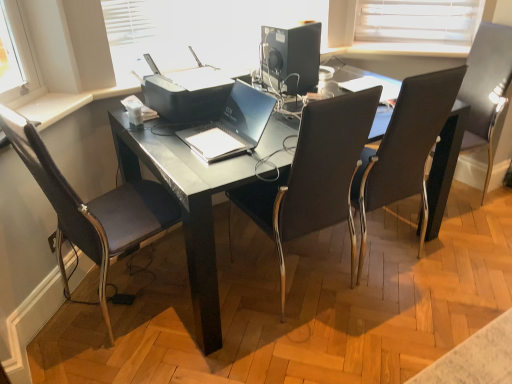
What is the approximate height of black leather chair at upper right, which is counted as the 1th chair, starting from the right?

black leather chair at upper right, which is counted as the 1th chair, starting from the right, is 3.30 feet tall.

Measure the distance between black leather chair at center, arranged as the 2th chair when viewed from the left, and camera.

black leather chair at center, arranged as the 2th chair when viewed from the left, and camera are 1.36 meters apart from each other.

At what (x,y) coordinates should I click in order to perform the action: click on black leather chair at center, which is the third chair in right-to-left order. Please return your answer as a coordinate pair (x, y). Looking at the image, I should click on (313, 176).

In order to face black leather chair at center, which appears as the second chair when viewed from the right, should I rotate leftwards or rightwards?

To face it directly, rotate right by 15.868 degrees.

Identify the location of black plastic desktop computer at upper center. The image size is (512, 384). (291, 57).

Is black leather chair at center, which appears as the second chair when viewed from the right, outside of black leather chair at upper right, which is counted as the 1th chair, starting from the right?

Indeed, black leather chair at center, which appears as the second chair when viewed from the right, is completely outside black leather chair at upper right, which is counted as the 1th chair, starting from the right.

Considering the relative sizes of black leather chair at center, placed as the third chair when sorted from left to right, and black leather chair at upper right, which is counted as the 1th chair, starting from the right, in the image provided, is black leather chair at center, placed as the third chair when sorted from left to right, wider than black leather chair at upper right, which is counted as the 1th chair, starting from the right,?

Correct, the width of black leather chair at center, placed as the third chair when sorted from left to right, exceeds that of black leather chair at upper right, which is counted as the 1th chair, starting from the right.

Could you tell me if black leather chair at center, placed as the third chair when sorted from left to right, is facing black leather chair at upper right, which is counted as the 1th chair, starting from the right?

No, black leather chair at center, placed as the third chair when sorted from left to right, does not turn towards black leather chair at upper right, which is counted as the 1th chair, starting from the right.

Who is taller, black leather chair at center, which appears as the second chair when viewed from the right, or black leather chair at upper right, acting as the 4th chair starting from the left?

Standing taller between the two is black leather chair at upper right, acting as the 4th chair starting from the left.

Is black leather chair at center, which appears as the second chair when viewed from the right, positioned with its back to black plastic printer at center?

black leather chair at center, which appears as the second chair when viewed from the right, does not have its back to black plastic printer at center.

Where is `the 1st chair in front of the black plastic printer at center`? the 1st chair in front of the black plastic printer at center is located at coordinates (405, 149).

Is black leather chair at center, which appears as the second chair when viewed from the right, far from black plastic printer at center?

No, black leather chair at center, which appears as the second chair when viewed from the right, is in close proximity to black plastic printer at center.

Can you tell me how much black leather chair at center, placed as the third chair when sorted from left to right, and black plastic printer at center differ in facing direction?

177 degrees separate the facing orientations of black leather chair at center, placed as the third chair when sorted from left to right, and black plastic printer at center.

Considering the positions of point (151, 63) and point (409, 180), is point (151, 63) closer or farther from the camera than point (409, 180)?

Point (151, 63).

Can you see black plastic printer at center touching black leather chair at center, placed as the third chair when sorted from left to right?

No, black plastic printer at center is not beside black leather chair at center, placed as the third chair when sorted from left to right.

Is black plastic printer at center taller or shorter than black leather chair at center, placed as the third chair when sorted from left to right?

Considering their sizes, black plastic printer at center has less height than black leather chair at center, placed as the third chair when sorted from left to right.

Can we say black plastic printer at center lies outside black leather chair at center, placed as the third chair when sorted from left to right?

black plastic printer at center lies outside black leather chair at center, placed as the third chair when sorted from left to right,'s area.

Find the location of a particular element. the 2nd chair in front of the black plastic desktop computer at upper center is located at coordinates (405, 149).

Which is in front, point (318, 62) or point (443, 100)?

Point (443, 100)

Which object is further away from the camera taking this photo, black plastic desktop computer at upper center or black leather chair at center, which appears as the second chair when viewed from the right?

black plastic desktop computer at upper center is behind.

Are black leather chair at upper right, acting as the 4th chair starting from the left, and black leather chair at center, which appears as the second chair when viewed from the right, located far from each other?

No, there isn't a large distance between black leather chair at upper right, acting as the 4th chair starting from the left, and black leather chair at center, which appears as the second chair when viewed from the right.

Is point (489, 120) closer or farther from the camera than point (394, 178)?

Point (489, 120) is positioned farther from the camera compared to point (394, 178).

Between black leather chair at upper right, acting as the 4th chair starting from the left, and black leather chair at center, placed as the third chair when sorted from left to right, which one has larger size?

black leather chair at center, placed as the third chair when sorted from left to right.

Measure the distance from black leather chair at upper right, which is counted as the 1th chair, starting from the right, to black leather chair at center, which appears as the second chair when viewed from the right.

They are 27.28 inches apart.

Based on their positions, is dark brown leather chair at left, positioned as the 1th chair in left-to-right order, located to the left or right of black glossy desk at center?

From the image, it's evident that dark brown leather chair at left, positioned as the 1th chair in left-to-right order, is to the left of black glossy desk at center.

You are a GUI agent. You are given a task and a screenshot of the screen. Output one action in this format:
    pyautogui.click(x=<x>, y=<y>)
    Task: Click on the desk above the dark brown leather chair at left, positioned as the 1th chair in left-to-right order (from the image's perspective)
    The width and height of the screenshot is (512, 384).
    Given the screenshot: What is the action you would take?
    pyautogui.click(x=187, y=208)

From the image's perspective, between dark brown leather chair at left, the 4th chair positioned from the right, and black glossy desk at center, which one is located above?

black glossy desk at center.

Is black leather chair at center, which appears as the second chair when viewed from the right, not inside matte plastic printer at upper center?

Yes, black leather chair at center, which appears as the second chair when viewed from the right, is outside of matte plastic printer at upper center.

From the image's perspective, would you say black leather chair at center, placed as the third chair when sorted from left to right, is shown under matte plastic printer at upper center?

Correct, black leather chair at center, placed as the third chair when sorted from left to right, appears lower than matte plastic printer at upper center in the image.

Would you consider black leather chair at center, placed as the third chair when sorted from left to right, to be distant from matte plastic printer at upper center?

Yes, black leather chair at center, placed as the third chair when sorted from left to right, and matte plastic printer at upper center are quite far apart.

The image size is (512, 384). Identify the location of the 1st chair located above the black leather chair at upper right, acting as the 4th chair starting from the left (from a real-world perspective). (405, 149).

Find the location of a particular element. The image size is (512, 384). printer that appears above the black leather chair at center, placed as the third chair when sorted from left to right (from the image's perspective) is located at coordinates (186, 92).

Based on their spatial positions, is black plastic desktop computer at upper center or black leather chair at upper right, acting as the 4th chair starting from the left, further from matte plastic printer at upper center?

black leather chair at upper right, acting as the 4th chair starting from the left, is further to matte plastic printer at upper center.

Estimate the real-world distances between objects in this image. Which object is closer to black leather chair at upper right, which is counted as the 1th chair, starting from the right, black leather chair at center, which is the third chair in right-to-left order, or black plastic desktop computer at upper center?

Among the two, black plastic desktop computer at upper center is located nearer to black leather chair at upper right, which is counted as the 1th chair, starting from the right.

Considering their positions, is black plastic printer at center positioned further to black plastic desktop computer at upper center than black leather chair at center, which is the third chair in right-to-left order?

black leather chair at center, which is the third chair in right-to-left order.

Considering their positions, is black plastic desktop computer at upper center positioned further to dark brown leather chair at left, the 4th chair positioned from the right, than black plastic printer at center?

Based on the image, black plastic desktop computer at upper center appears to be further to dark brown leather chair at left, the 4th chair positioned from the right.

Estimate the real-world distances between objects in this image. Which object is closer to black leather chair at upper right, acting as the 4th chair starting from the left, black leather chair at center, which is the third chair in right-to-left order, or black leather chair at center, which appears as the second chair when viewed from the right?

Based on the image, black leather chair at center, which appears as the second chair when viewed from the right, appears to be nearer to black leather chair at upper right, acting as the 4th chair starting from the left.

From the image, which object appears to be farther from black leather chair at upper right, acting as the 4th chair starting from the left, black leather chair at center, arranged as the 2th chair when viewed from the left, or matte plastic printer at upper center?

matte plastic printer at upper center is positioned further to the anchor black leather chair at upper right, acting as the 4th chair starting from the left.

Estimate the real-world distances between objects in this image. Which object is further from black glossy desk at center, black plastic printer at center or matte plastic printer at upper center?

Based on the image, matte plastic printer at upper center appears to be further to black glossy desk at center.

In the scene shown: Which object lies nearer to the anchor point matte plastic printer at upper center, black leather chair at center, arranged as the 2th chair when viewed from the left, or black leather chair at upper right, acting as the 4th chair starting from the left?

The object closer to matte plastic printer at upper center is black leather chair at center, arranged as the 2th chair when viewed from the left.

I want to click on desk situated between satin black laptop at center and black leather chair at center, placed as the third chair when sorted from left to right, from left to right, so click(187, 208).

Identify the location of chair between black glossy desk at center and black leather chair at center, placed as the third chair when sorted from left to right, in the horizontal direction. (313, 176).

I want to click on desk situated between matte plastic printer at upper center and black leather chair at upper right, acting as the 4th chair starting from the left, from left to right, so click(187, 208).

I want to click on desk between dark brown leather chair at left, the 4th chair positioned from the right, and black leather chair at center, which is the third chair in right-to-left order, in the horizontal direction, so click(187, 208).